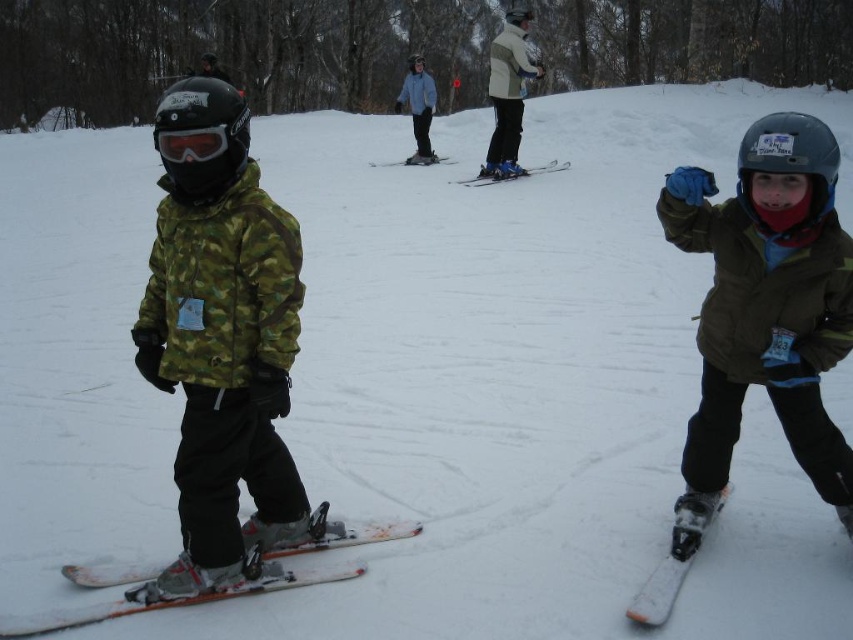
Question: Is beige jacket at center positioned at the back of white matte snowboard at lower right?

Choices:
 (A) no
 (B) yes

Answer: (B)

Question: Is white matte snowboard at lower right wider than light blue fabric jacket at center?

Choices:
 (A) yes
 (B) no

Answer: (B)

Question: Which point is closer to the camera?

Choices:
 (A) orange metallic skis at left
 (B) matte black goggles at left

Answer: (B)

Question: Is beige jacket at center thinner than white plastic skis at center?

Choices:
 (A) no
 (B) yes

Answer: (A)

Question: Which object appears farthest from the camera in this image?

Choices:
 (A) light blue fabric jacket at center
 (B) blue metallic ski at center

Answer: (A)

Question: Which of the following is the farthest from the observer?

Choices:
 (A) (224, 131)
 (B) (503, 163)
 (C) (308, 524)

Answer: (B)